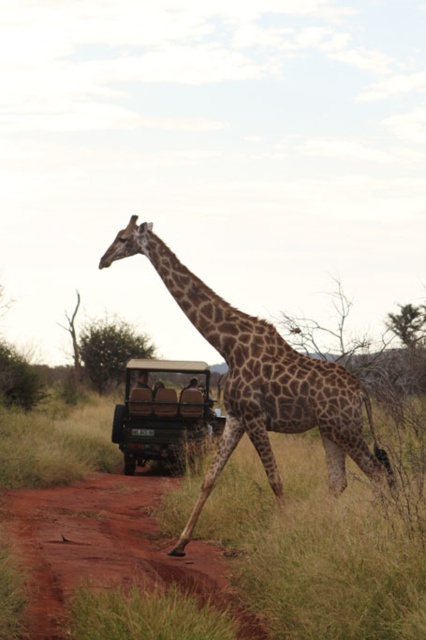
Is green grass at center shorter than spotted brown giraffe at center?

Yes, green grass at center is shorter than spotted brown giraffe at center.

Is point (288, 483) farther from camera compared to point (357, 413)?

Yes, point (288, 483) is farther from viewer.

The height and width of the screenshot is (640, 426). What are the coordinates of `green grass at center` in the screenshot? It's located at (218, 554).

Which is behind, point (307, 369) or point (146, 449)?

Positioned behind is point (146, 449).

Between spotted brown giraffe at center and brown leather jeep at center, which one is positioned lower?

brown leather jeep at center is lower down.

Does point (267, 444) come behind point (115, 440)?

No.

The height and width of the screenshot is (640, 426). I want to click on spotted brown giraffe at center, so click(261, 380).

In the scene shown: Is green grass at center positioned before brown dirt track at lower left?

Yes, it is in front of brown dirt track at lower left.

Who is lower down, green grass at center or brown dirt track at lower left?

brown dirt track at lower left is below.

Measure the distance between point [365,552] and camera.

Point [365,552] and camera are 15.89 feet apart.

Where is `green grass at center`? green grass at center is located at coordinates (218, 554).